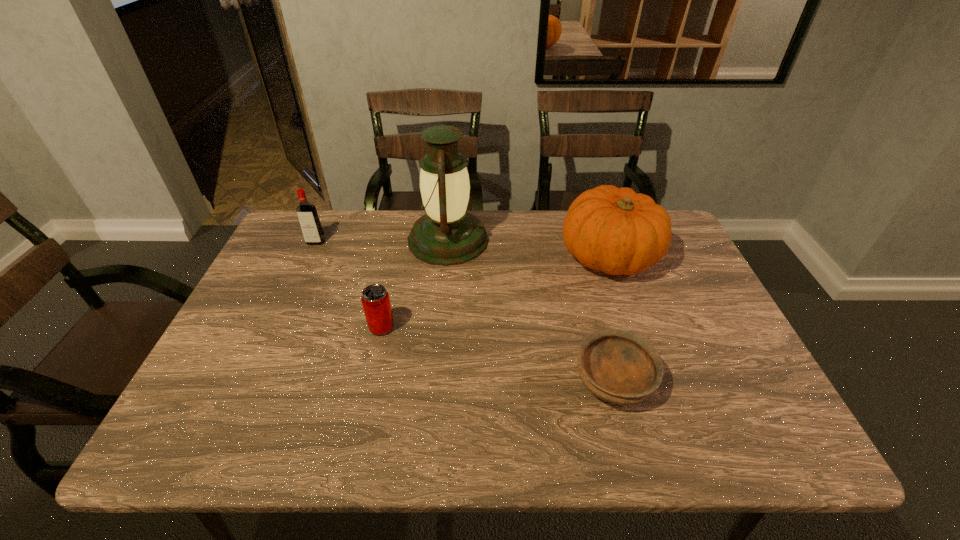
Where is `vacant space at the far edge of the desktop`? vacant space at the far edge of the desktop is located at coordinates (423, 214).

I want to click on vacant space at the near edge of the desktop, so click(640, 422).

Identify the location of free space at the left edge of the desktop. pos(268,273).

Find the location of a particular element. Image resolution: width=960 pixels, height=540 pixels. vacant area at the right edge of the desktop is located at coordinates (687, 363).

At what (x,y) coordinates should I click in order to perform the action: click on vacant space at the far left corner of the desktop. Please return your answer as a coordinate pair (x, y). Looking at the image, I should click on (324, 212).

Where is `free point at the far right corner`? free point at the far right corner is located at coordinates (667, 252).

In order to click on vacant space at the near right corner of the desktop in this screenshot , I will do `click(717, 426)`.

Identify the location of free space between the tallest object and the leftmost object. The width and height of the screenshot is (960, 540). (382, 241).

I want to click on vacant point located between the leftmost object and the second nearest object, so click(348, 285).

The image size is (960, 540). I want to click on vacant region between the vodka and the nearest object, so click(465, 311).